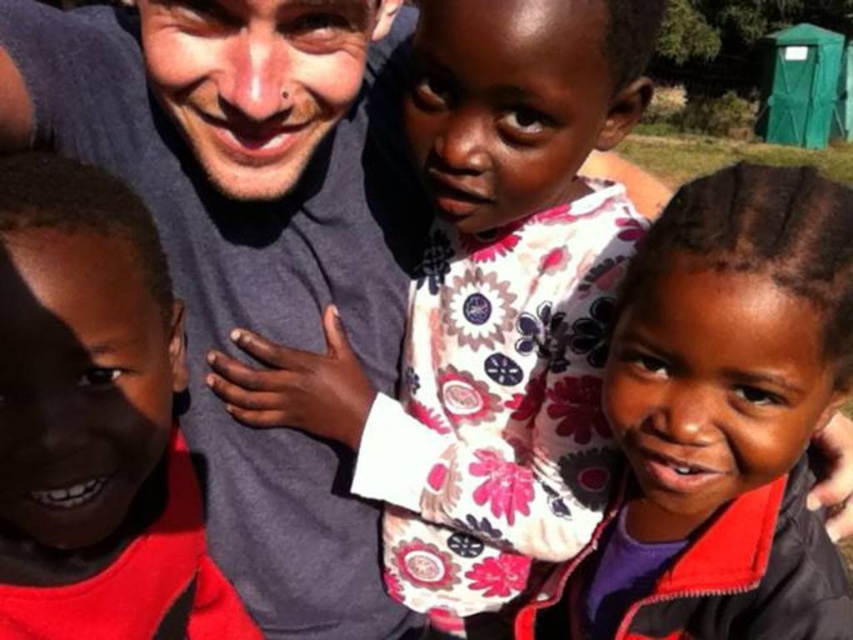
Please look at the image and locate the point at coordinates [718,420]. Which object is this point located on?

The point at coordinates [718,420] is located on the matte floral dress at center.

In the scene described, where is the matte floral dress at center relative to the matte red shirt at left?

The matte floral dress at center is to the right of the matte red shirt at left.